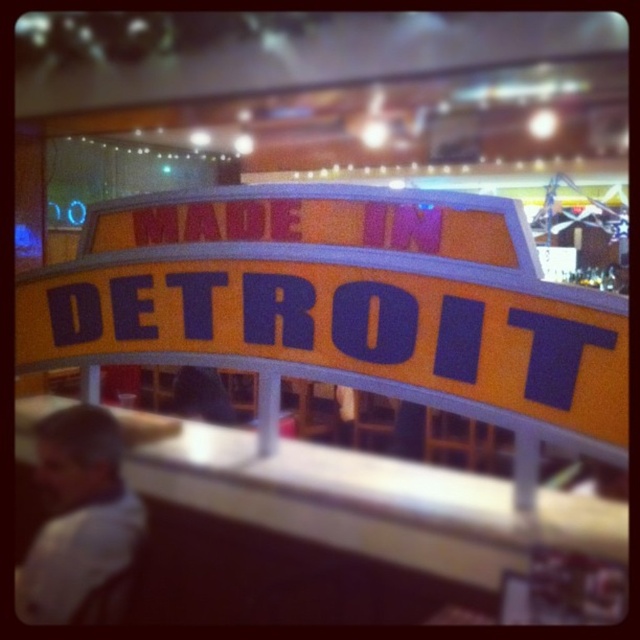
You are standing in front of the yellow matte sign at center. Where exactly is the yellow matte sign at center located in relation to the point marked at coordinates [339,304]?

The yellow matte sign at center is exactly at the point marked by the coordinates [339,304].

You are standing in front of the sign that says MADE IN DETROIT. There are two points marked on the floor in front of you. The first point is at coordinate (x=550, y=422) and the second point is at coordinate (x=86, y=602). Which point is closer to you?

Point (x=550, y=422) is in front of point (x=86, y=602), so the first point is closer to you.